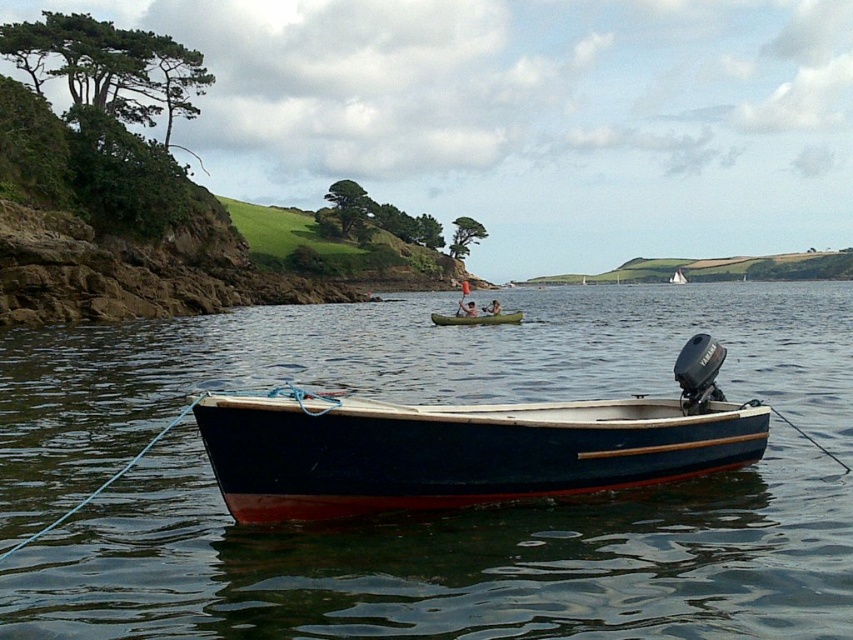
Question: Observing the image, what is the correct spatial positioning of smooth dark blue water at center in reference to green plastic canoe at center?

Choices:
 (A) right
 (B) left

Answer: (A)

Question: Does green plastic canoe at center have a greater width compared to smooth white kayak at center?

Choices:
 (A) no
 (B) yes

Answer: (B)

Question: Which point is closer to the camera?

Choices:
 (A) (x=485, y=321)
 (B) (x=683, y=278)
 (C) (x=558, y=486)

Answer: (C)

Question: Which object is farther from the camera taking this photo?

Choices:
 (A) smooth white kayak at center
 (B) green plastic canoe at center
 (C) dark blue polished wood boat at center
 (D) smooth dark blue water at center

Answer: (A)

Question: Which point appears closest to the camera in this image?

Choices:
 (A) (463, 310)
 (B) (680, 268)
 (C) (683, 413)
 (D) (733, 602)

Answer: (D)

Question: Considering the relative positions of smooth dark blue water at center and dark blue polished wood boat at center in the image provided, where is smooth dark blue water at center located with respect to dark blue polished wood boat at center?

Choices:
 (A) above
 (B) below

Answer: (A)